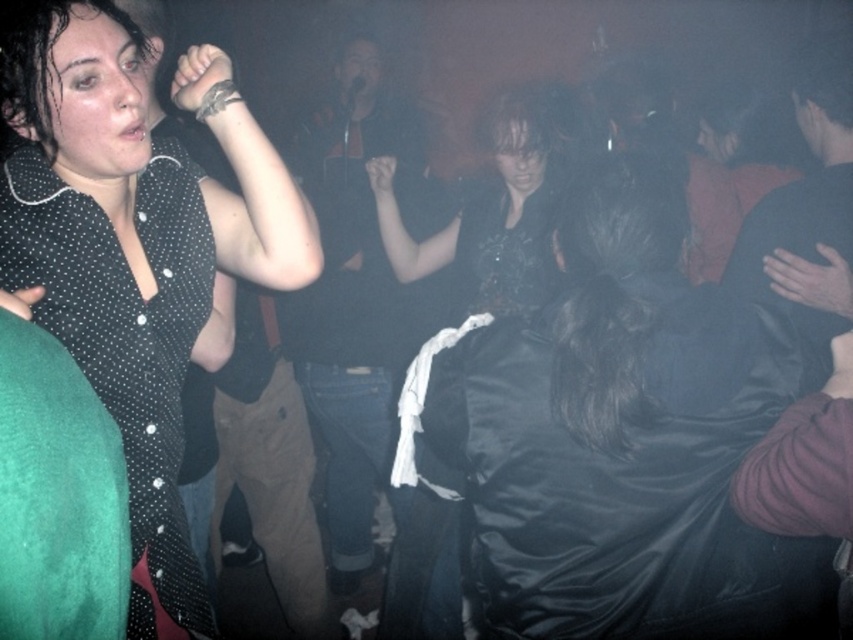
I want to click on shiny black dress at center, so pos(625,436).

Is shiny black dress at center taller than black dotted shirt at upper left?

Incorrect, shiny black dress at center's height is not larger of black dotted shirt at upper left's.

Measure the distance between shiny black dress at center and camera.

shiny black dress at center and camera are 1.19 meters apart.

The height and width of the screenshot is (640, 853). What are the coordinates of `shiny black dress at center` in the screenshot? It's located at (625, 436).